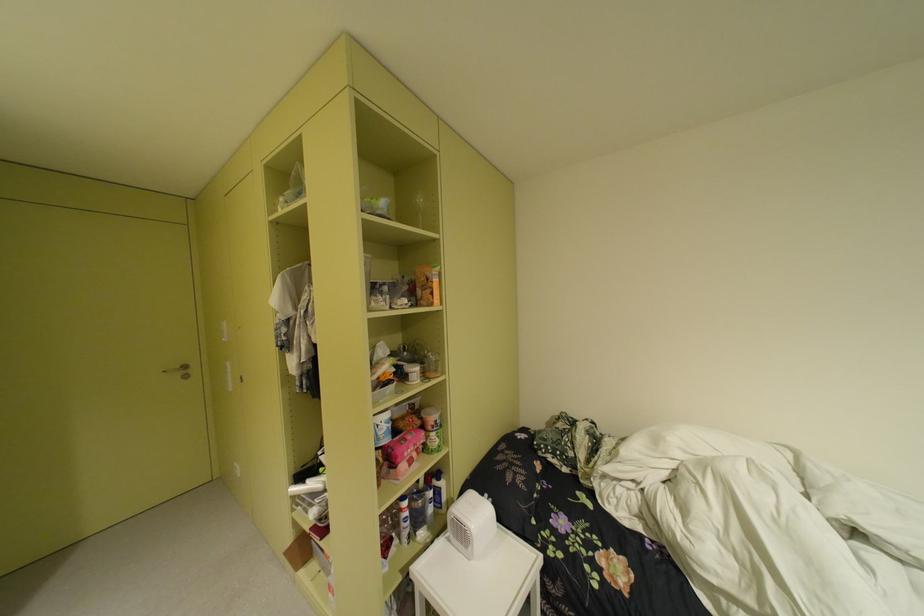
Where is `white portable heater`? This screenshot has height=616, width=924. white portable heater is located at coordinates (470, 524).